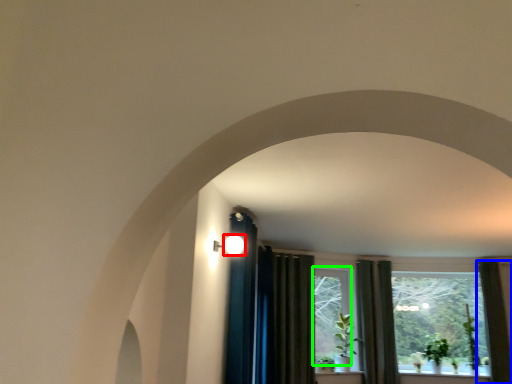
Question: Which is nearer to the light (highlighted by a red box)? curtain (highlighted by a blue box) or window (highlighted by a green box).

Choices:
 (A) curtain
 (B) window

Answer: (B)